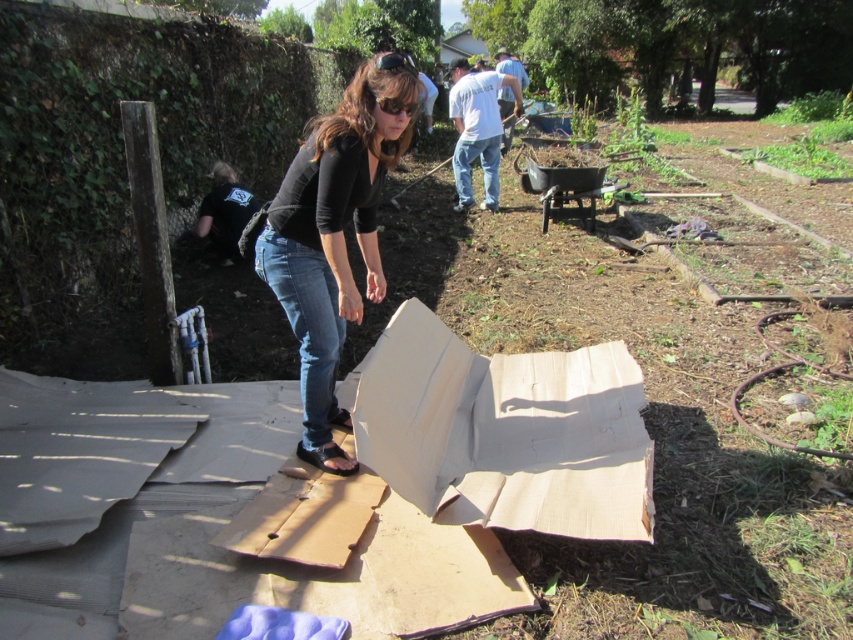
Between white cardboard box at center and matte black shirt at center, which one has more height?

With more height is matte black shirt at center.

Which is in front, point (447, 358) or point (355, 292)?

Positioned in front is point (355, 292).

In order to click on white cardboard box at center in this screenshot , I will do coord(506,432).

At what (x,y) coordinates should I click in order to perform the action: click on white cardboard box at center. Please return your answer as a coordinate pair (x, y). The height and width of the screenshot is (640, 853). Looking at the image, I should click on (506, 432).